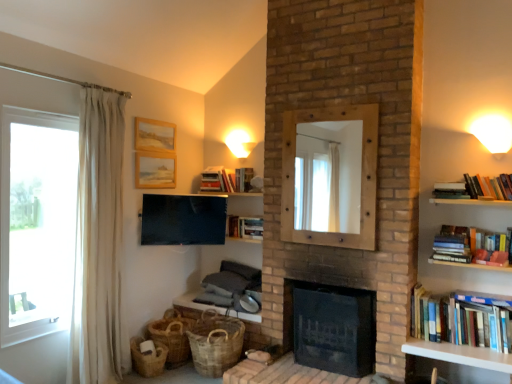
Question: Looking at their shapes, would you say hardcover book at upper center, positioned as the fourth book in right-to-left order, is wider or thinner than wooden picture frame at upper center, the first picture frame ordered from the bottom?

Choices:
 (A) thin
 (B) wide

Answer: (B)

Question: Based on their sizes in the image, would you say hardcover book at upper center, acting as the fourth book starting from the top, is bigger or smaller than wooden picture frame at upper center, acting as the second picture frame starting from the top?

Choices:
 (A) small
 (B) big

Answer: (B)

Question: Considering the real-world distances, which object is closest to the white matte wall sconce at upper right, which is the second light fixture in back-to-front order?

Choices:
 (A) hardcover books at upper center, which is the fifth book from bottom to top
 (B) wooden mirror at center, arranged as the first fireplace when viewed from the top
 (C) wooden picture frame at upper center, the first picture frame ordered from the bottom
 (D) hardcover books at right, which is counted as the first book, starting from the front
 (E) brown woven basket at lower left, which ranks as the first basket in right-to-left order

Answer: (B)

Question: Which is nearer to the wooden picture frame at upper center, which is the first picture frame from top to bottom?

Choices:
 (A) dark brick fireplace at center, the 2th fireplace viewed from the top
 (B) hardcover book at upper center, positioned as the 4th book in front-to-back order
 (C) transparent glass window at left
 (D) hardcover book at upper right, arranged as the 3th book when viewed from the top
 (E) hardcover books at upper center, which is counted as the 1th book, starting from the top

Answer: (E)